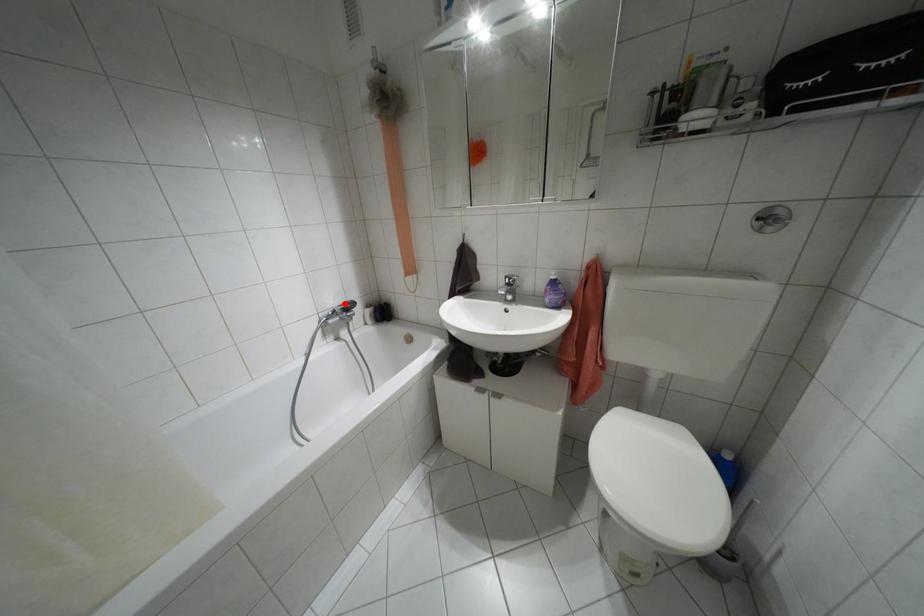
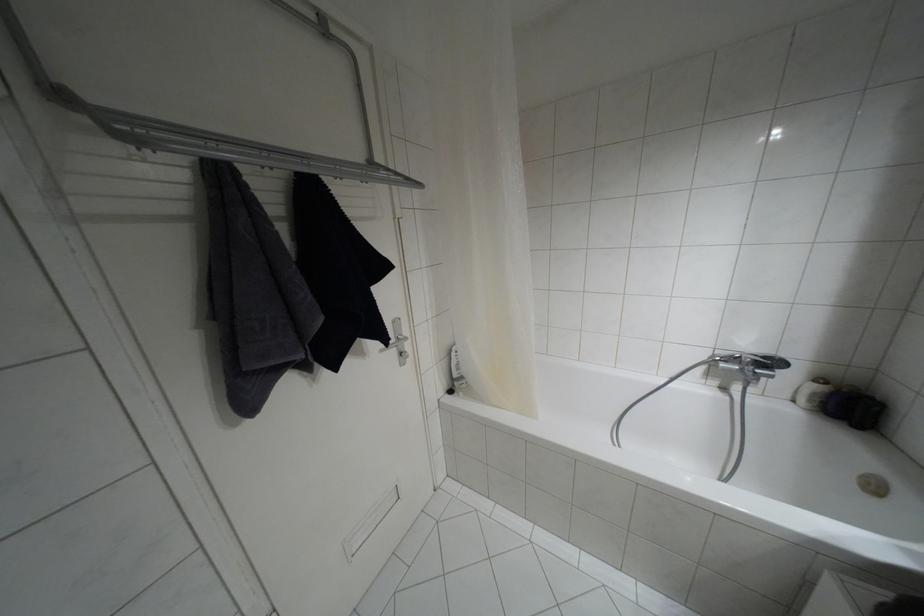
Question: I am providing you with two images of the same scene from different viewpoints. A red point is shown in image1. For the corresponding object point in image2, is it positioned nearer or farther from the camera?

Choices:
 (A) Nearer
 (B) Farther

Answer: (B)